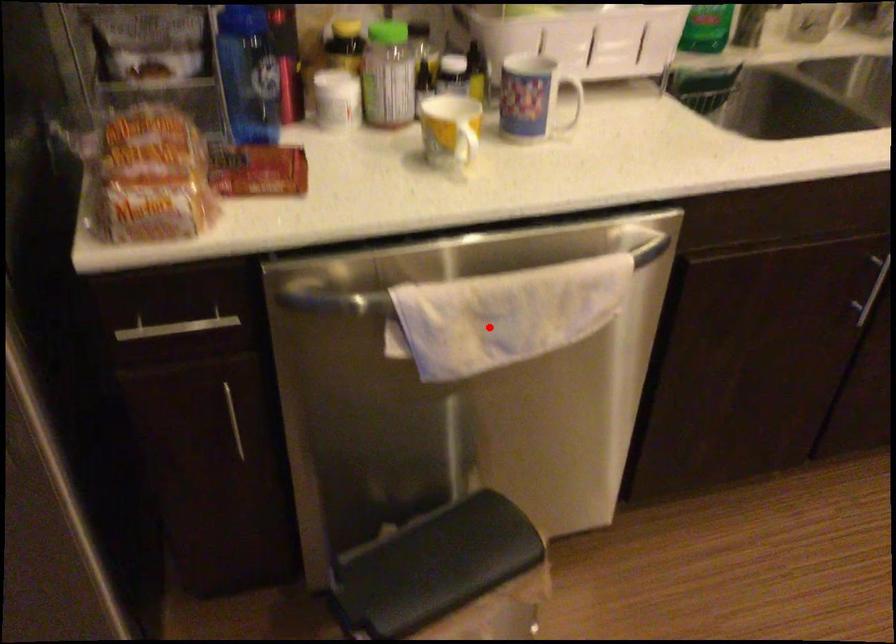
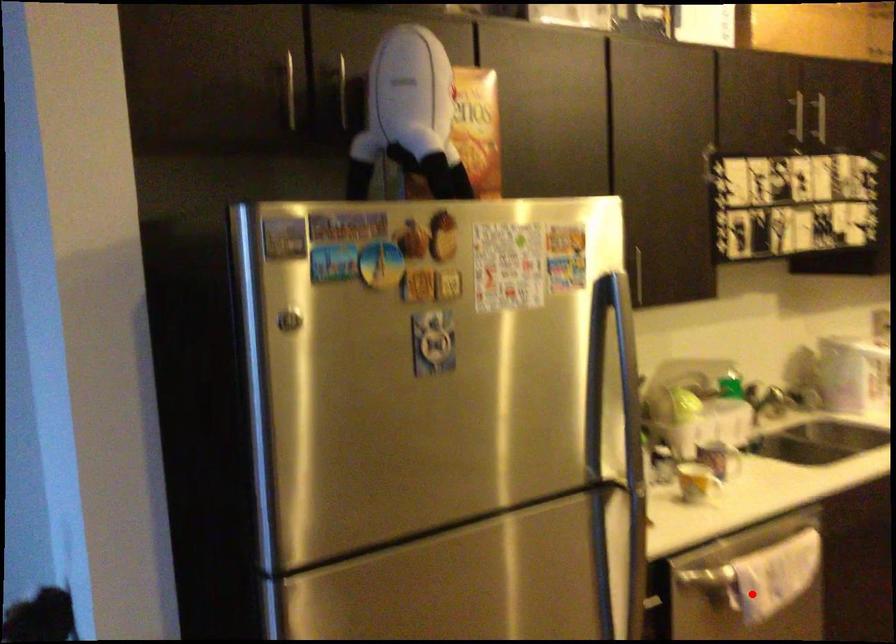
I am providing you with two images of the same scene from different viewpoints. A red point is marked on the first image and another point is marked on the second image. Does the point marked in image1 correspond to the same location as the one in image2?

Yes